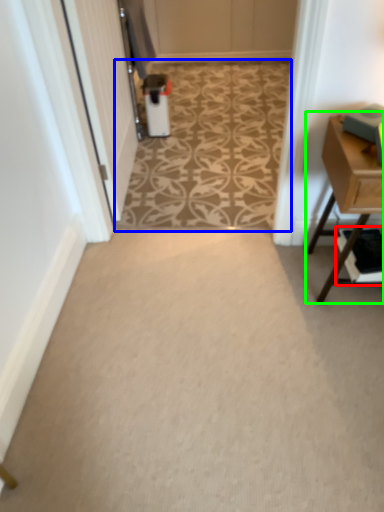
Question: Considering the real-world distances, which object is farthest from shelf (highlighted by a red box)? pattern (highlighted by a blue box) or table (highlighted by a green box)?

Choices:
 (A) pattern
 (B) table

Answer: (A)